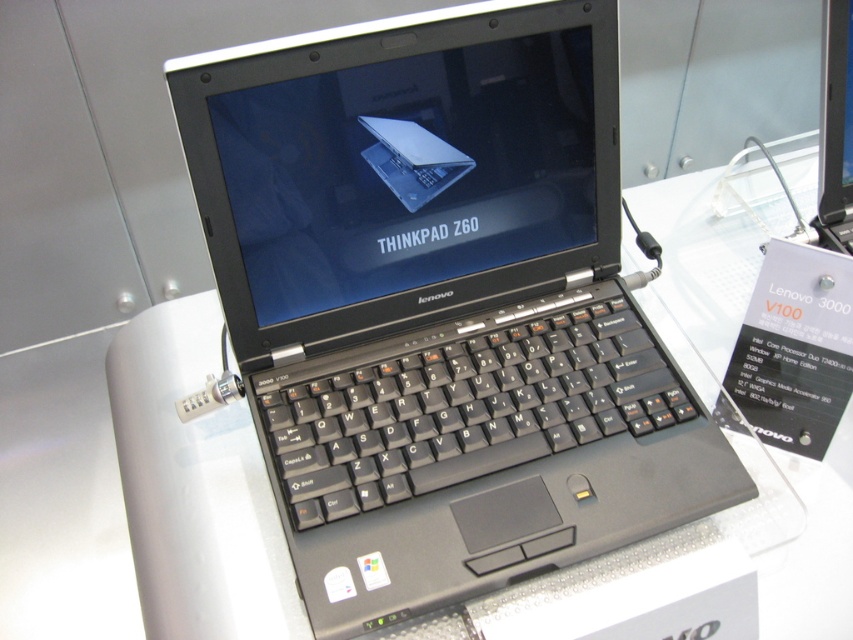
You are a tech reviewer standing at the exhibition. You notice two laptops at the center of the display. Which one is closer to you, the black plastic laptop at center or the sleek silver laptop at center?

The black plastic laptop at center is closer to you because it is in front of the sleek silver laptop at center.

You are at a tech exhibition and see two laptops displayed on a stand. The black plastic laptop at center and the sleek silver laptop at center. Which one has a greater height?

The black plastic laptop at center is taller than the sleek silver laptop at center according to the description.

You are at a tech exhibition and see a Lenovo ThinkPad Z60 laptop on display. There is a point labeled at coordinates (x=440, y=307). Based on the description, can you determine what object this point is located on?

The point labeled at coordinates (x=440, y=307) is located on the black plastic laptop at center.